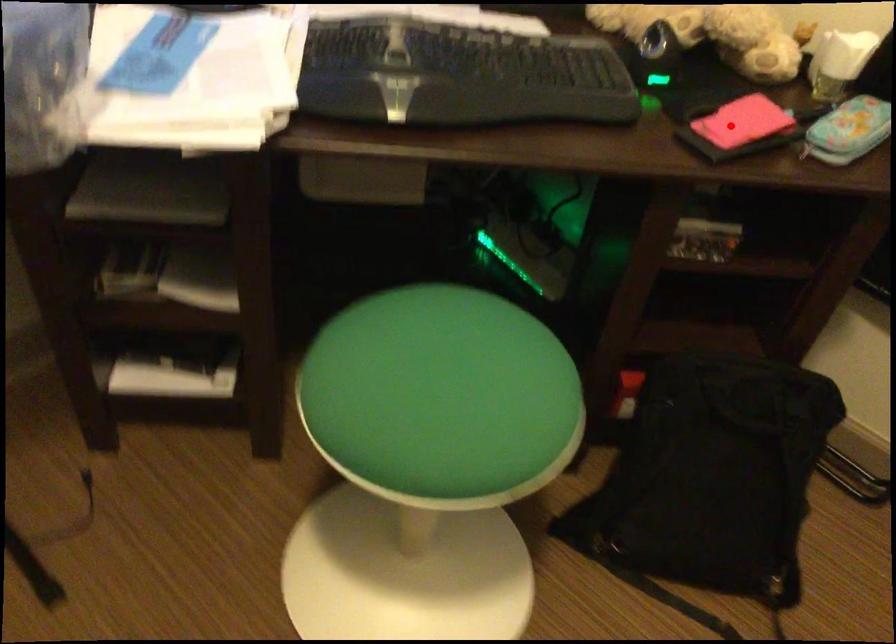
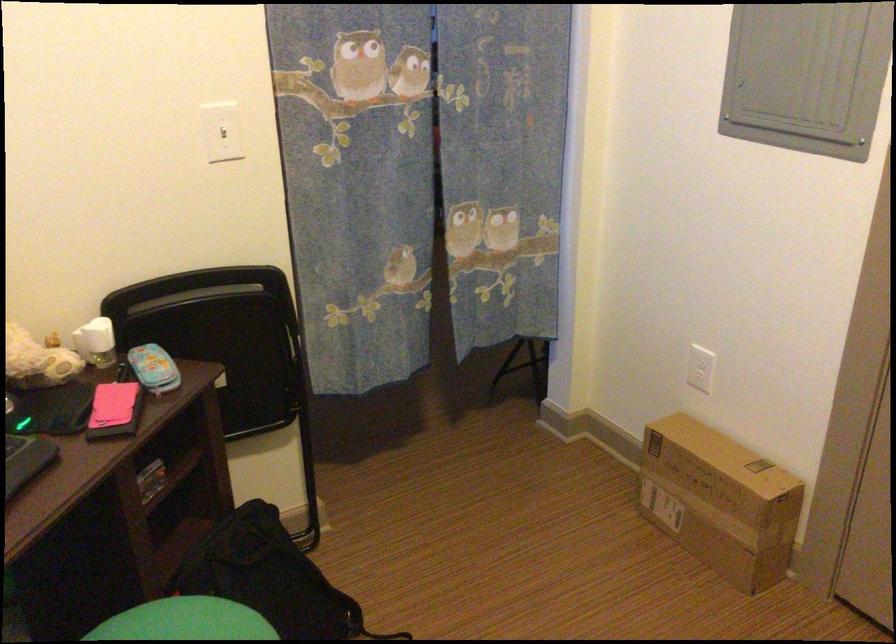
The point at the highlighted location is marked in the first image. Where is the corresponding point in the second image?

(114, 410)